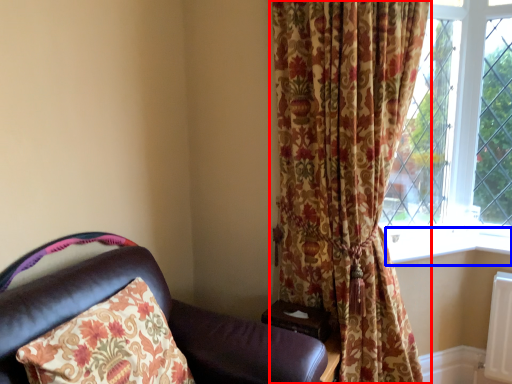
Question: Which object is further to the camera taking this photo, curtain (highlighted by a red box) or window sill (highlighted by a blue box)?

Choices:
 (A) curtain
 (B) window sill

Answer: (B)